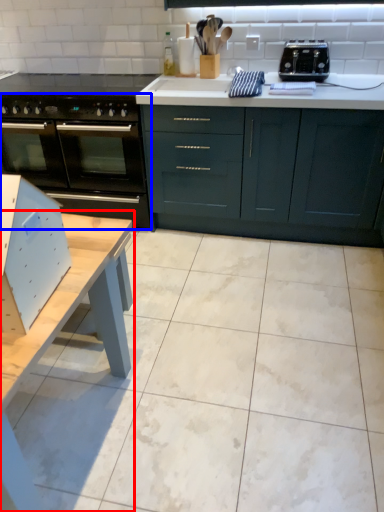
Question: Which object appears closest to the camera in this image, table (highlighted by a red box) or oven (highlighted by a blue box)?

Choices:
 (A) table
 (B) oven

Answer: (A)